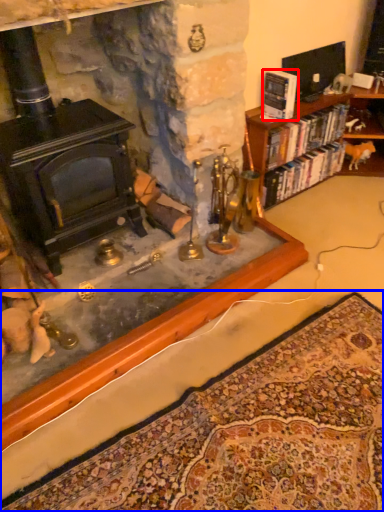
Question: Among these objects, which one is nearest to the camera, book (highlighted by a red box) or mat (highlighted by a blue box)?

Choices:
 (A) book
 (B) mat

Answer: (B)